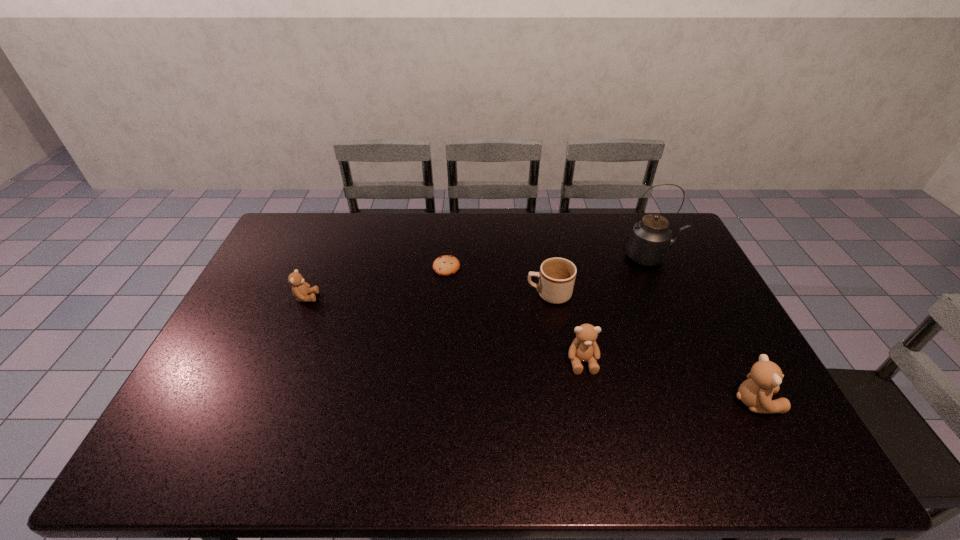
Where is `teddy bear that is the second closest to the second tallest object`? The image size is (960, 540). teddy bear that is the second closest to the second tallest object is located at coordinates (300, 289).

Where is `free location that satisfies the following two spatial constraints: 1. spout on the tallest object; 2. on the front-facing side of the second teddy bear from left to right`? This screenshot has height=540, width=960. free location that satisfies the following two spatial constraints: 1. spout on the tallest object; 2. on the front-facing side of the second teddy bear from left to right is located at coordinates (700, 362).

I want to click on free point that satisfies the following two spatial constraints: 1. spout on the kettle; 2. on the front side of the shortest object, so click(x=657, y=267).